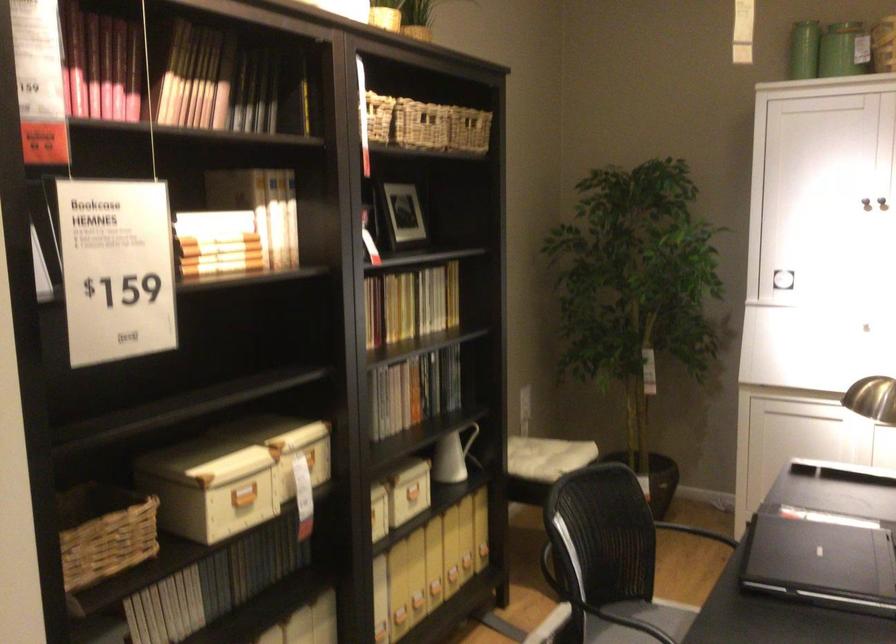
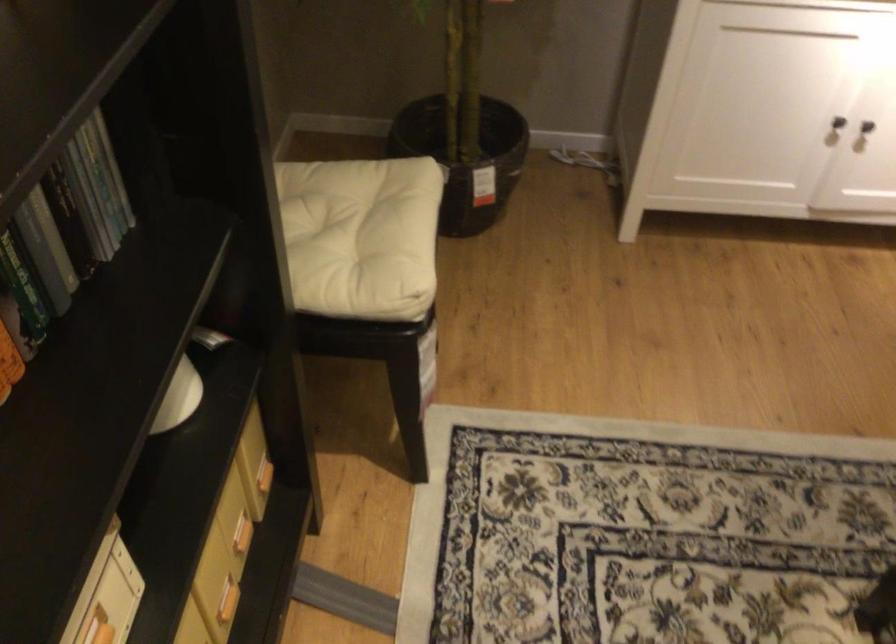
In the second image, find the point that corresponds to pixel 461 561 in the first image.

(240, 534)